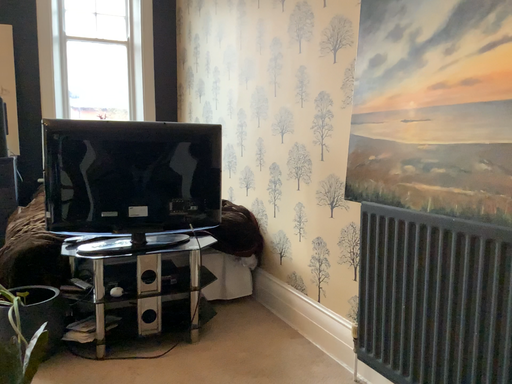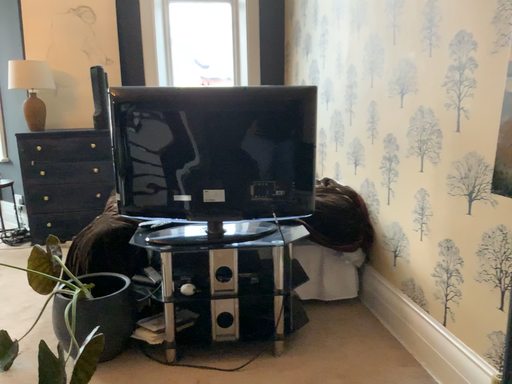
Question: How did the camera likely rotate when shooting the video?

Choices:
 (A) rotated right
 (B) rotated left

Answer: (B)